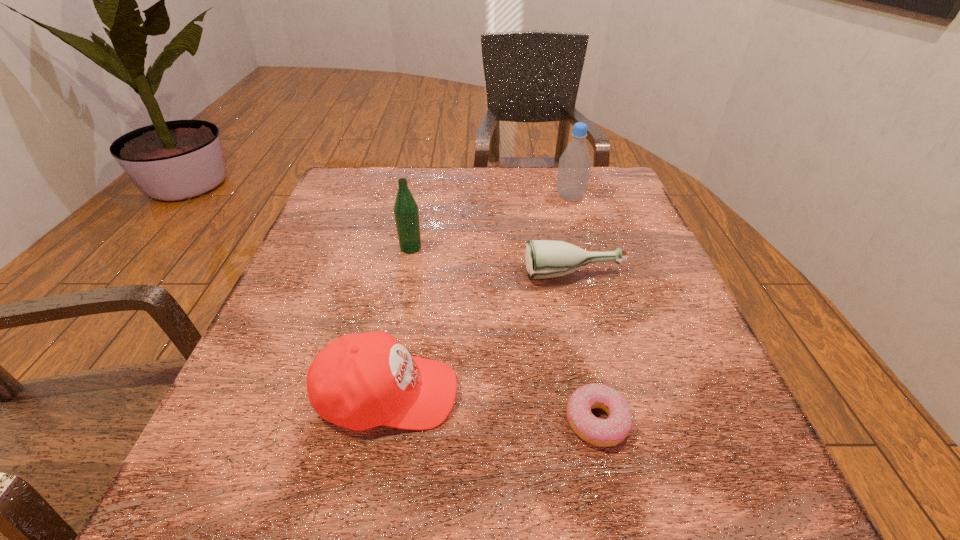
At what (x,y) coordinates should I click in order to perform the action: click on the farthest object. Please return your answer as a coordinate pair (x, y). Looking at the image, I should click on (574, 167).

The image size is (960, 540). In order to click on the fourth shortest object in this screenshot , I will do `click(406, 212)`.

I want to click on the second farthest object, so click(406, 212).

Where is `the third shortest object`? This screenshot has width=960, height=540. the third shortest object is located at coordinates (360, 381).

The height and width of the screenshot is (540, 960). Identify the location of the third nearest object. (544, 258).

Locate an element on the screen. This screenshot has width=960, height=540. the nearest bottle is located at coordinates (544, 258).

The height and width of the screenshot is (540, 960). I want to click on doughnut, so click(607, 432).

Locate an element on the screen. Image resolution: width=960 pixels, height=540 pixels. free region located 0.230m on the left of the farthest object is located at coordinates (463, 197).

Locate an element on the screen. The image size is (960, 540). blank space located on the back of the second tallest object is located at coordinates (424, 176).

Locate an element on the screen. Image resolution: width=960 pixels, height=540 pixels. vacant space situated on the front panel of the third shortest object is located at coordinates (523, 394).